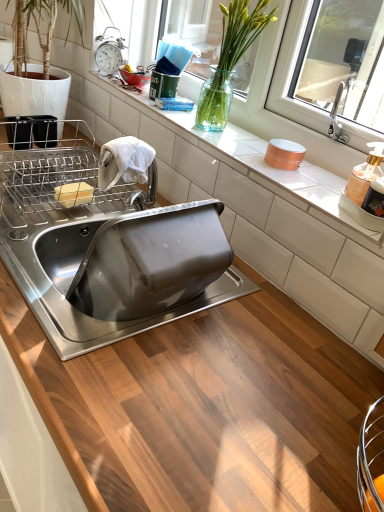
Question: From a real-world perspective, does translucent plastic soap dispenser at right stand above stainless steel sink at center?

Choices:
 (A) yes
 (B) no

Answer: (A)

Question: Is translucent plastic soap dispenser at right shorter than stainless steel sink at center?

Choices:
 (A) no
 (B) yes

Answer: (B)

Question: Considering the relative sizes of translucent plastic soap dispenser at right and stainless steel sink at center in the image provided, is translucent plastic soap dispenser at right bigger than stainless steel sink at center?

Choices:
 (A) yes
 (B) no

Answer: (B)

Question: Is translucent plastic soap dispenser at right located outside stainless steel sink at center?

Choices:
 (A) no
 (B) yes

Answer: (B)

Question: Is translucent plastic soap dispenser at right in front of stainless steel sink at center?

Choices:
 (A) no
 (B) yes

Answer: (A)

Question: Considering the relative positions of stainless steel sink at center and translucent glass vase at upper center in the image provided, is stainless steel sink at center to the left or to the right of translucent glass vase at upper center?

Choices:
 (A) right
 (B) left

Answer: (B)

Question: Considering their positions, is stainless steel sink at center located in front of or behind translucent glass vase at upper center?

Choices:
 (A) front
 (B) behind

Answer: (A)

Question: Considering the positions of stainless steel sink at center and translucent glass vase at upper center in the image, is stainless steel sink at center taller or shorter than translucent glass vase at upper center?

Choices:
 (A) short
 (B) tall

Answer: (B)

Question: From a real-world perspective, is stainless steel sink at center physically located above or below translucent glass vase at upper center?

Choices:
 (A) below
 (B) above

Answer: (A)

Question: Considering the positions of point (349, 183) and point (206, 130), is point (349, 183) closer or farther from the camera than point (206, 130)?

Choices:
 (A) farther
 (B) closer

Answer: (B)

Question: From a real-world perspective, relative to translucent glass vase at upper center, is translucent plastic soap dispenser at right vertically above or below?

Choices:
 (A) below
 (B) above

Answer: (A)

Question: Is translucent plastic soap dispenser at right in front of or behind translucent glass vase at upper center in the image?

Choices:
 (A) front
 (B) behind

Answer: (A)

Question: From the image's perspective, is translucent plastic soap dispenser at right above or below translucent glass vase at upper center?

Choices:
 (A) below
 (B) above

Answer: (A)

Question: Would you say stainless steel sink at center is to the left or to the right of metallic silver alarm clock at upper left in the picture?

Choices:
 (A) left
 (B) right

Answer: (A)

Question: Considering the positions of point (31, 240) and point (125, 46), is point (31, 240) closer or farther from the camera than point (125, 46)?

Choices:
 (A) farther
 (B) closer

Answer: (B)